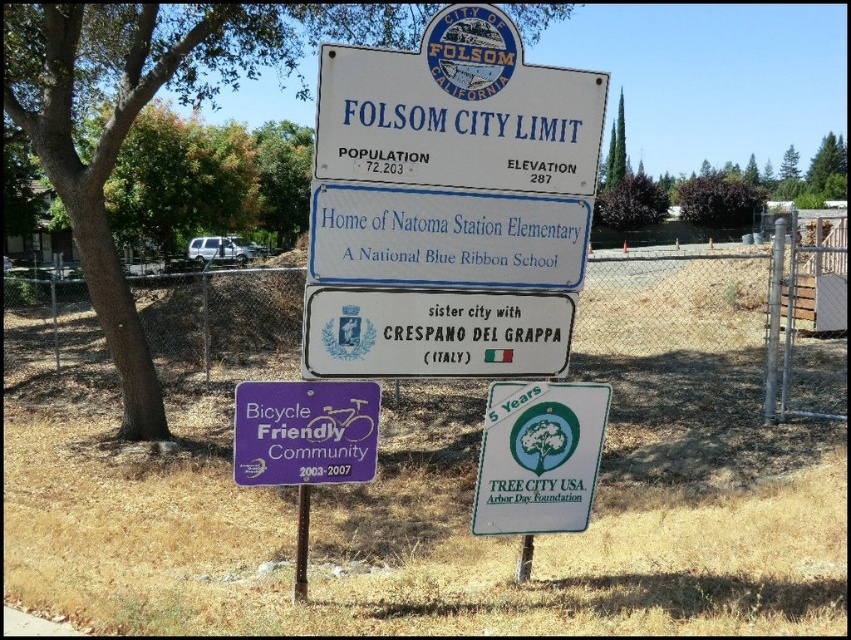
Where is `purple plastic bicycle friendly community sign at lower center`? Image resolution: width=851 pixels, height=640 pixels. purple plastic bicycle friendly community sign at lower center is located at coordinates (304, 433).

Is point (253, 456) positioned after point (306, 547)?

No, (253, 456) is in front of (306, 547).

What do you see at coordinates (304, 433) in the screenshot? I see `purple plastic bicycle friendly community sign at lower center` at bounding box center [304, 433].

At what (x,y) coordinates should I click in order to perform the action: click on purple plastic bicycle friendly community sign at lower center. Please return your answer as a coordinate pair (x, y). Looking at the image, I should click on (304, 433).

Which is more to the left, metal chain-link fence at center or green paper sign at lower right?

From the viewer's perspective, green paper sign at lower right appears more on the left side.

Can you confirm if metal chain-link fence at center is positioned to the right of green paper sign at lower right?

Correct, you'll find metal chain-link fence at center to the right of green paper sign at lower right.

What do you see at coordinates (729, 314) in the screenshot? I see `metal chain-link fence at center` at bounding box center [729, 314].

Locate an element on the screen. This screenshot has width=851, height=640. metal chain-link fence at center is located at coordinates (729, 314).

Which is in front, point (507, 392) or point (261, 474)?

Point (261, 474) is in front.

Is green paper sign at lower right closer to camera compared to purple plastic bicycle friendly community sign at lower center?

No, green paper sign at lower right is behind purple plastic bicycle friendly community sign at lower center.

Is point (546, 456) closer to camera compared to point (273, 483)?

That is False.

Find the location of a particular element. The width and height of the screenshot is (851, 640). green paper sign at lower right is located at coordinates (540, 458).